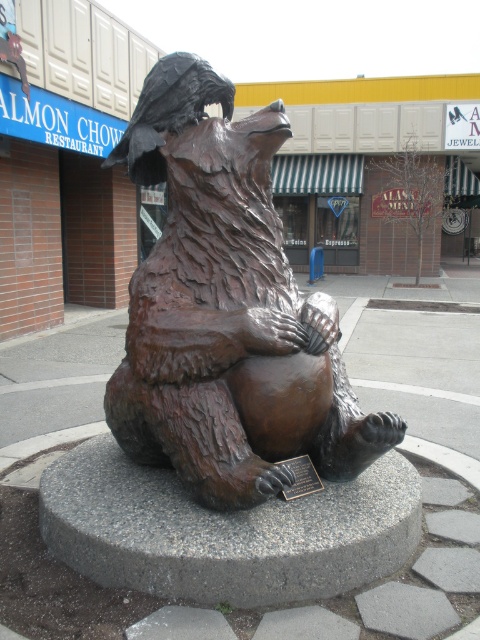
You are standing in front of the sculpture and want to read the plaque. Which direction should you move to face the bronze plaque at center from the bronze bear statue at center?

You should move to your right to face the bronze plaque at center since the bronze bear statue at center is to the left of it.

Based on the photo, you are a tour guide explaining the sculpture to visitors. You want to point out the bronze plaque at center to a visitor who is looking at the bronze bear statue at center. Which direction should you tell them to look relative to the bear?

The bronze plaque at center is located below the bronze bear statue at center. Tell them to look downward from the bear to find the plaque.